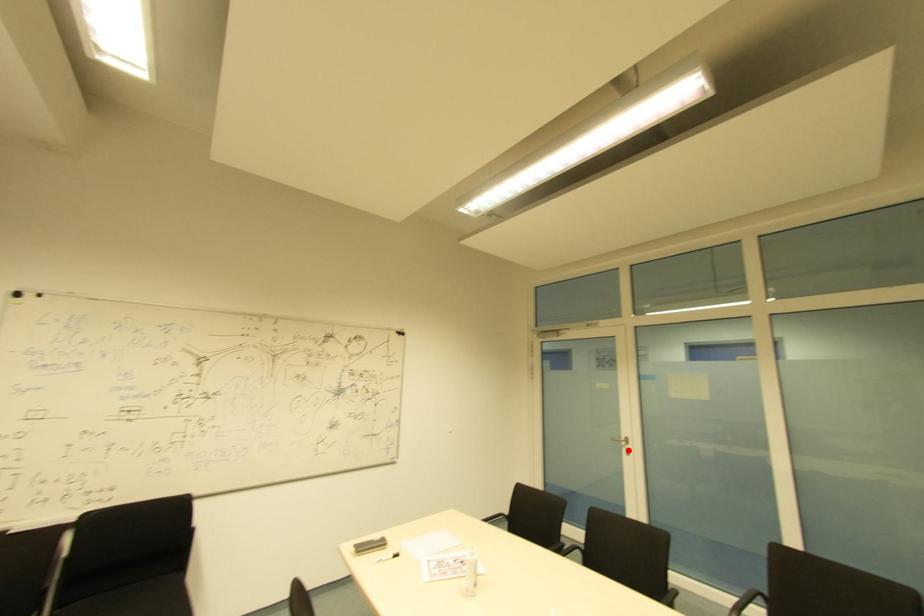
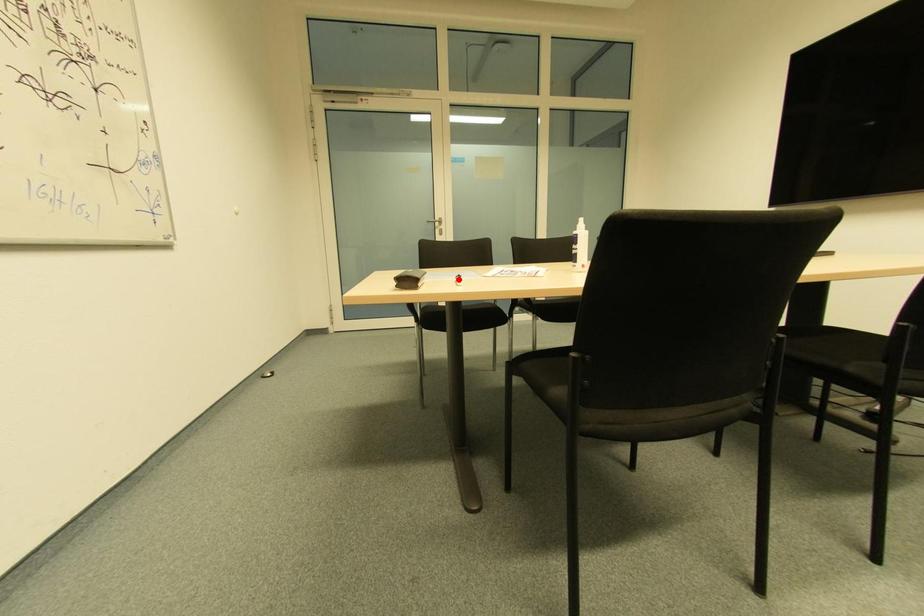
I am providing you with two images of the same scene from different viewpoints. A red point is marked on the first image and another point is marked on the second image. Does the point marked in image1 correspond to the same location as the one in image2?

No